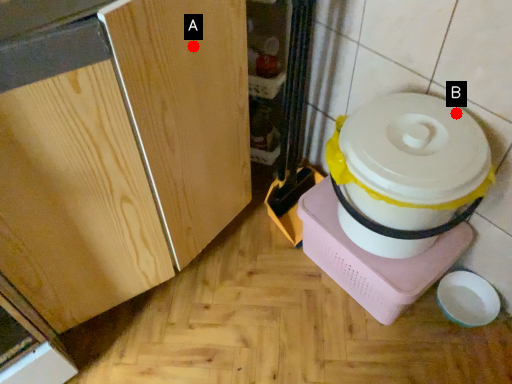
Question: Two points are circled on the image, labeled by A and B beside each circle. Which point is closer to the camera?

Choices:
 (A) A is closer
 (B) B is closer

Answer: (A)